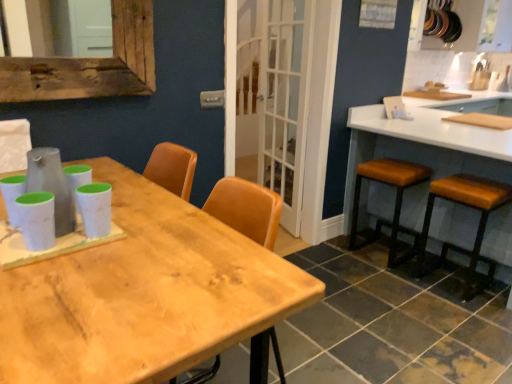
Locate an element on the screen. The width and height of the screenshot is (512, 384). white matte chair at upper left is located at coordinates (14, 145).

Identify the location of white glossy countertop at right. (432, 139).

Describe the element at coordinates (395, 201) in the screenshot. Image resolution: width=512 pixels, height=384 pixels. I see `brown leather stool at right, which is the 2th stool in right-to-left order` at that location.

Where is `white matte chair at upper left`? white matte chair at upper left is located at coordinates (14, 145).

Who is more distant, wooden table at center or brown leather stool at right, which is counted as the 1th stool, starting from the left?

brown leather stool at right, which is counted as the 1th stool, starting from the left, is further from the camera.

Is wooden table at center bigger or smaller than brown leather stool at right, which is counted as the 1th stool, starting from the left?

wooden table at center is bigger than brown leather stool at right, which is counted as the 1th stool, starting from the left.

Does wooden table at center touch brown leather stool at right, which is the 2th stool in right-to-left order?

No, wooden table at center is not beside brown leather stool at right, which is the 2th stool in right-to-left order.

Which is correct: white matte chair at upper left is inside brown leather stool at right, which is the 2th stool in right-to-left order, or outside of it?

white matte chair at upper left is outside brown leather stool at right, which is the 2th stool in right-to-left order.

From the image's perspective, would you say white matte chair at upper left is shown under brown leather stool at right, which is the 2th stool in right-to-left order?

No, from the image's perspective, white matte chair at upper left is not beneath brown leather stool at right, which is the 2th stool in right-to-left order.

Is there a large distance between white matte chair at upper left and brown leather stool at right, which is the 2th stool in right-to-left order?

Indeed, white matte chair at upper left is not near brown leather stool at right, which is the 2th stool in right-to-left order.

Which is correct: white glass screen door at center is inside brown leather stool at right, which is counted as the 1th stool, starting from the left, or outside of it?

white glass screen door at center is outside brown leather stool at right, which is counted as the 1th stool, starting from the left.

From a real-world perspective, is white glass screen door at center positioned under brown leather stool at right, which is the 2th stool in right-to-left order, based on gravity?

No.

Can you confirm if white glass screen door at center is positioned to the right of brown leather stool at right, which is counted as the 1th stool, starting from the left?

No.

Is brown leather stool at right, which is counted as the 1th stool, starting from the left, not within wooden table at center?

Yes.

Are brown leather stool at right, which is the 2th stool in right-to-left order, and wooden table at center far apart?

Yes, brown leather stool at right, which is the 2th stool in right-to-left order, and wooden table at center are quite far apart.

From the image's perspective, between brown leather stool at right, which is counted as the 1th stool, starting from the left, and wooden table at center, which one is located above?

brown leather stool at right, which is counted as the 1th stool, starting from the left, is shown above in the image.

Considering the sizes of brown leather stool at right, which is counted as the 1th stool, starting from the left, and wooden table at center in the image, is brown leather stool at right, which is counted as the 1th stool, starting from the left, taller or shorter than wooden table at center?

Clearly, brown leather stool at right, which is counted as the 1th stool, starting from the left, is shorter compared to wooden table at center.

This screenshot has height=384, width=512. Find the location of `table that is on the left side of white glass screen door at center`. table that is on the left side of white glass screen door at center is located at coordinates (146, 296).

Does wooden table at center have a greater height compared to white glass screen door at center?

In fact, wooden table at center may be shorter than white glass screen door at center.

From the image's perspective, which one is positioned lower, wooden table at center or white glass screen door at center?

wooden table at center.

Is white glossy countertop at right thinner than wooden table at center?

Incorrect, the width of white glossy countertop at right is not less than that of wooden table at center.

This screenshot has height=384, width=512. Find the location of `table in front of the white glossy countertop at right`. table in front of the white glossy countertop at right is located at coordinates (146, 296).

Considering the relative positions of white glossy countertop at right and wooden table at center in the image provided, is white glossy countertop at right to the right of wooden table at center from the viewer's perspective?

Indeed, white glossy countertop at right is positioned on the right side of wooden table at center.

Can you confirm if brown leather stool at right, the second stool viewed from the left, is wider than white glass screen door at center?

Correct, the width of brown leather stool at right, the second stool viewed from the left, exceeds that of white glass screen door at center.

Can you tell me how much brown leather stool at right, the second stool viewed from the left, and white glass screen door at center differ in facing direction?

The angular difference between brown leather stool at right, the second stool viewed from the left, and white glass screen door at center is 163 degrees.

Considering the sizes of brown leather stool at right, positioned as the 1th stool in right-to-left order, and white glass screen door at center in the image, is brown leather stool at right, positioned as the 1th stool in right-to-left order, taller or shorter than white glass screen door at center?

In the image, brown leather stool at right, positioned as the 1th stool in right-to-left order, appears to be shorter than white glass screen door at center.

Considering their positions, is brown leather stool at right, positioned as the 1th stool in right-to-left order, located in front of or behind white glass screen door at center?

In the image, brown leather stool at right, positioned as the 1th stool in right-to-left order, appears in front of white glass screen door at center.

The height and width of the screenshot is (384, 512). I want to click on table on the left of brown leather stool at right, which is the 2th stool in right-to-left order, so click(x=146, y=296).

In the image, there is a brown leather stool at right, which is counted as the 1th stool, starting from the left. Where is `chair above it (from the image's perspective)`? The width and height of the screenshot is (512, 384). chair above it (from the image's perspective) is located at coordinates (14, 145).

Considering their positions, is wooden table at center positioned further to white glass screen door at center than white glossy countertop at right?

wooden table at center is positioned further to the anchor white glass screen door at center.

From the image, which object appears to be farther from white glossy countertop at right, white matte chair at upper left or wooden table at center?

white matte chair at upper left lies further to white glossy countertop at right than the other object.

Based on their spatial positions, is wooden table at center or brown leather stool at right, positioned as the 1th stool in right-to-left order, further from white matte chair at upper left?

brown leather stool at right, positioned as the 1th stool in right-to-left order, is further to white matte chair at upper left.

When comparing their distances from wooden table at center, does brown leather stool at right, which is counted as the 1th stool, starting from the left, or white glass screen door at center seem further?

brown leather stool at right, which is counted as the 1th stool, starting from the left, lies further to wooden table at center than the other object.

Based on their spatial positions, is wooden table at center or white glossy countertop at right further from white matte chair at upper left?

white glossy countertop at right.

From the image, which object appears to be farther from brown leather stool at right, which is counted as the 1th stool, starting from the left, wooden table at center or white glass screen door at center?

wooden table at center lies further to brown leather stool at right, which is counted as the 1th stool, starting from the left, than the other object.

From the image, which object appears to be nearer to brown leather stool at right, positioned as the 1th stool in right-to-left order, white matte chair at upper left or brown leather stool at right, which is the 2th stool in right-to-left order?

Among the two, brown leather stool at right, which is the 2th stool in right-to-left order, is located nearer to brown leather stool at right, positioned as the 1th stool in right-to-left order.

Based on their spatial positions, is white matte chair at upper left or brown leather stool at right, which is counted as the 1th stool, starting from the left, further from wooden table at center?

Among the two, brown leather stool at right, which is counted as the 1th stool, starting from the left, is located further to wooden table at center.

The image size is (512, 384). I want to click on screen door situated between white matte chair at upper left and white glossy countertop at right from left to right, so click(285, 101).

In order to click on screen door between white matte chair at upper left and brown leather stool at right, the second stool viewed from the left, from left to right in this screenshot , I will do `click(285, 101)`.

I want to click on stool situated between white matte chair at upper left and brown leather stool at right, positioned as the 1th stool in right-to-left order, from left to right, so click(395, 201).

Where is `counter between wooden table at center and brown leather stool at right, which is the 2th stool in right-to-left order, in the front-back direction`? The height and width of the screenshot is (384, 512). counter between wooden table at center and brown leather stool at right, which is the 2th stool in right-to-left order, in the front-back direction is located at coordinates (432, 139).